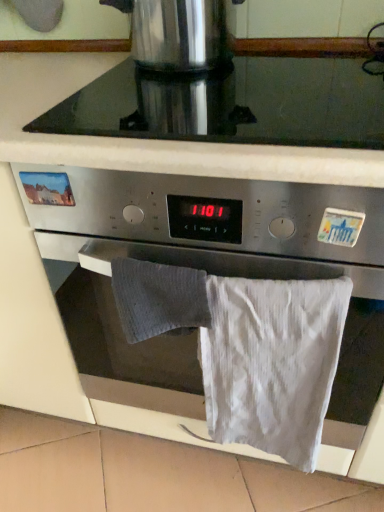
Question: Do you think stainless steel coffee pot at upper center is within black glass at upper center, or outside of it?

Choices:
 (A) outside
 (B) inside

Answer: (A)

Question: Looking at the image, does stainless steel coffee pot at upper center seem bigger or smaller compared to black glass at upper center?

Choices:
 (A) small
 (B) big

Answer: (A)

Question: Which object is the closest to the white cotton bath towel at lower center?

Choices:
 (A) black glass at upper center
 (B) satin silver oven at center
 (C) stainless steel coffee pot at upper center

Answer: (B)

Question: Considering the real-world distances, which object is closest to the satin silver oven at center?

Choices:
 (A) white cotton bath towel at lower center
 (B) stainless steel coffee pot at upper center
 (C) black glass at upper center

Answer: (A)